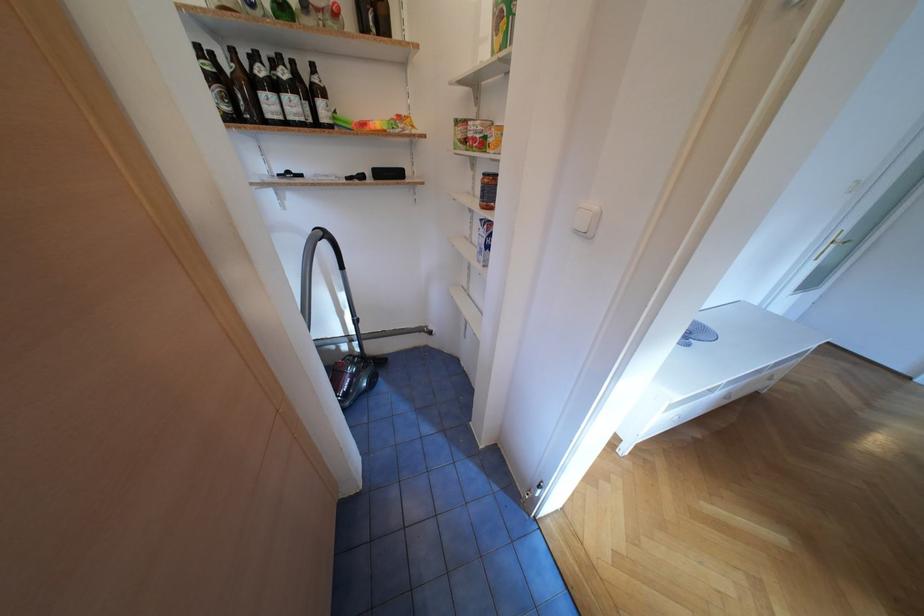
This screenshot has width=924, height=616. Identify the location of canned food. (488, 190).